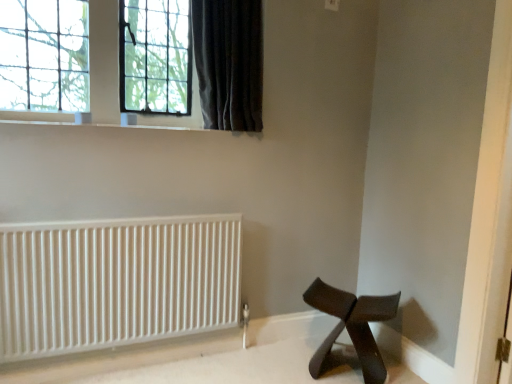
Question: From a real-world perspective, is clear glass window at upper left physically located above or below black matte stool at lower right?

Choices:
 (A) below
 (B) above

Answer: (B)

Question: Considering the positions of point (151, 120) and point (364, 304), is point (151, 120) closer or farther from the camera than point (364, 304)?

Choices:
 (A) farther
 (B) closer

Answer: (A)

Question: Which object is positioned closest to the dark velvet curtain at upper left?

Choices:
 (A) white matte radiator at lower left
 (B) clear glass window at upper left
 (C) black matte stool at lower right

Answer: (B)

Question: Considering the real-world distances, which object is farthest from the clear glass window at upper left?

Choices:
 (A) white matte radiator at lower left
 (B) black matte stool at lower right
 (C) dark velvet curtain at upper left

Answer: (B)